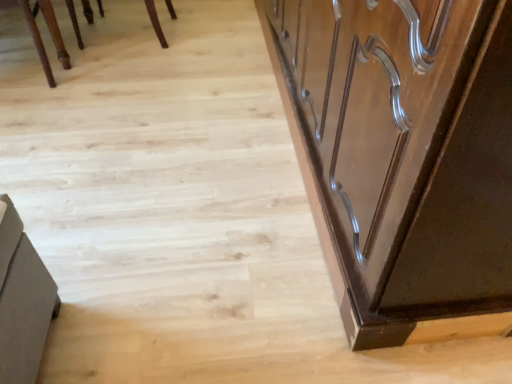
What do you see at coordinates (37, 40) in the screenshot? Image resolution: width=512 pixels, height=384 pixels. I see `brown wood chair leg at upper left` at bounding box center [37, 40].

You are a GUI agent. You are given a task and a screenshot of the screen. Output one action in this format:
    pyautogui.click(x=<x>, y=<y>)
    Task: Click on the brown wood chair leg at upper left
    
    Given the screenshot: What is the action you would take?
    pyautogui.click(x=37, y=40)

Locate an element on the screen. The height and width of the screenshot is (384, 512). brown wood chair leg at upper left is located at coordinates (37, 40).